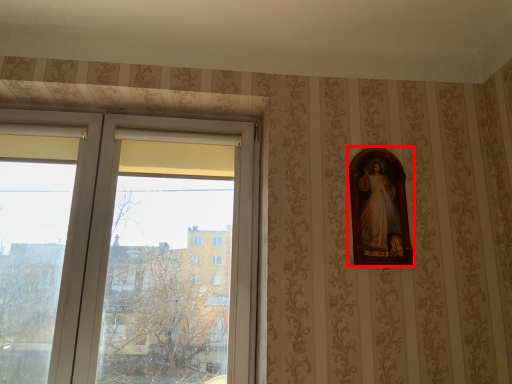
Question: From the image's perspective, what is the correct spatial positioning of picture frame (annotated by the red box) in reference to window?

Choices:
 (A) above
 (B) below

Answer: (A)